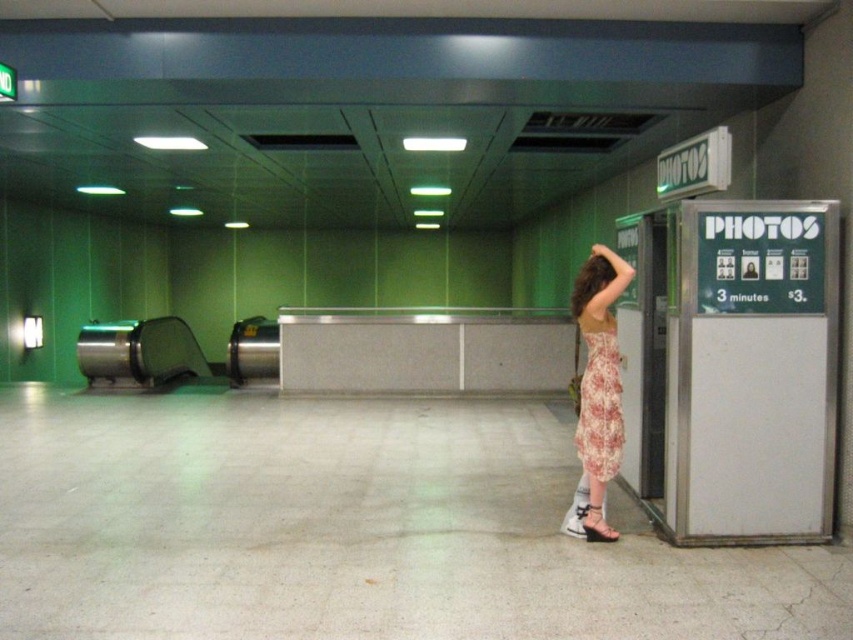
Consider the image. You are a photographer in the photo kiosk area and need to position your camera to capture both the floral dress at right and the floral print fabric dress at right. Which dress should you focus on first to ensure it appears larger in the photo?

The floral dress at right is much taller than the floral print fabric dress at right, so focusing on the floral dress at right first will ensure it appears larger in the photo.

You are a photographer observing a woman in a floral dress at right and a white leather sandal at lower right. Which item takes up more horizontal space?

The floral dress at right takes up more horizontal space because its width surpasses that of the white leather sandal at lower right.